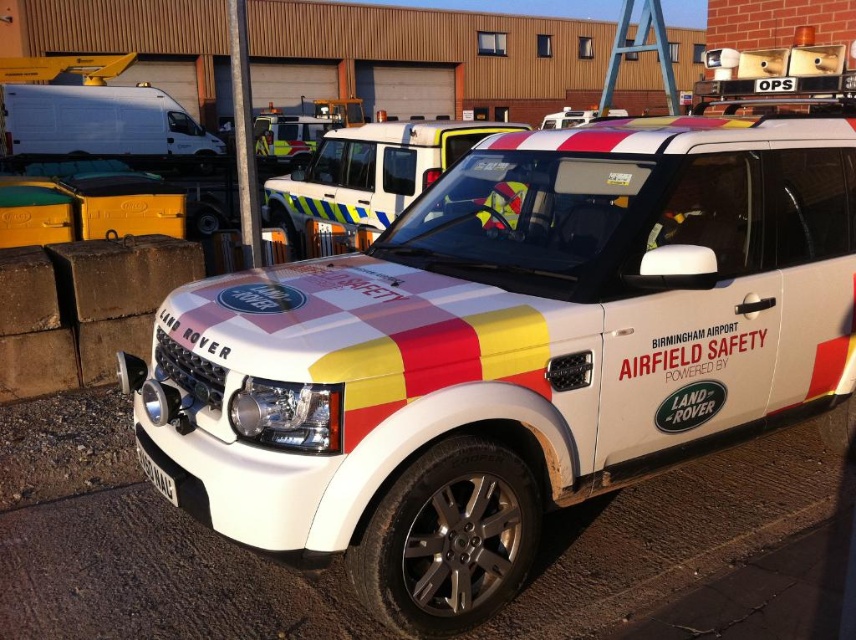
You are standing in a parking lot and see the white glossy SUV at center. If you want to take a photo of it from a distance of exactly 10 feet, should you move closer or farther away?

The white glossy SUV at center is currently 8.55 feet away from you. To achieve a distance of 10 feet, you need to move farther away by approximately 1.45 feet.

You are standing in front of the white Land Rover vehicle. There are two points marked on the vehicle. One is at coordinate point (367, 196) and the other at point (311, 131). Which point is closer to you?

Point (367, 196) is closer to the camera than point (311, 131), so the point at (367, 196) is closer to you.